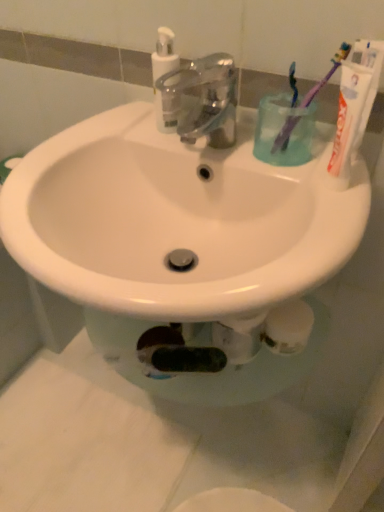
Where is `vacant space in between translucent plastic pump bottle at upper center and white matte toothpaste at upper right`? This screenshot has width=384, height=512. vacant space in between translucent plastic pump bottle at upper center and white matte toothpaste at upper right is located at coordinates click(x=239, y=154).